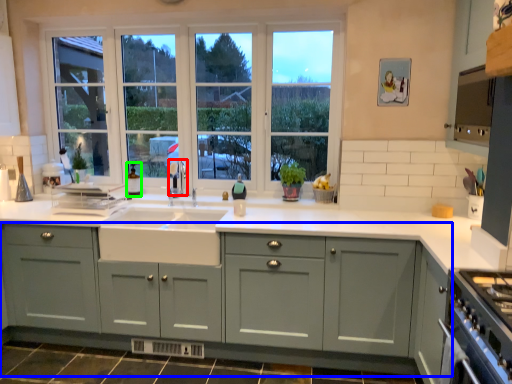
Question: Which object is positioned farthest from faucet (highlighted by a red box)? Select from cabinetry (highlighted by a blue box) and bottle (highlighted by a green box).

Choices:
 (A) cabinetry
 (B) bottle

Answer: (A)